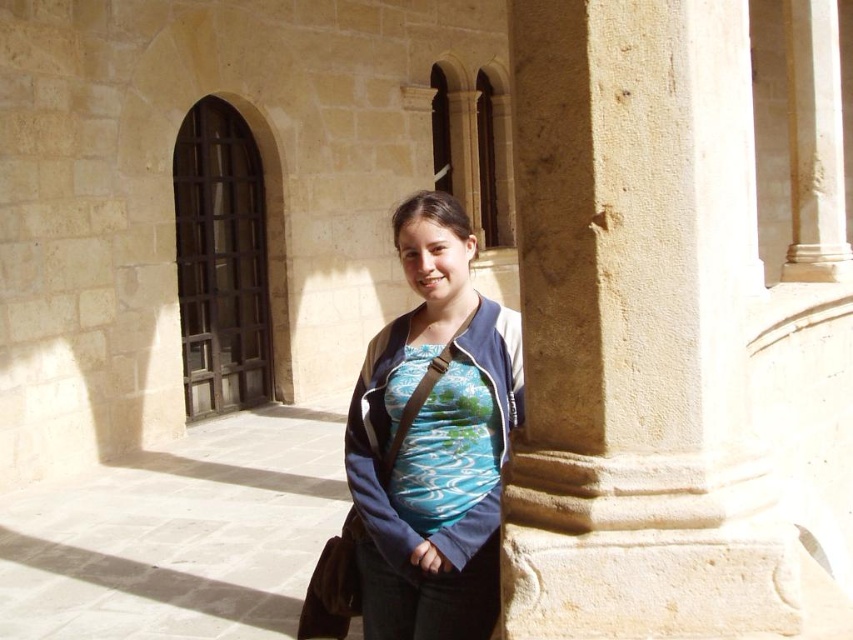
Is point (669, 51) positioned behind point (373, 442)?

No, (669, 51) is closer to viewer.

Does point (718, 452) lie in front of point (410, 202)?

Yes.

Does point (636, 269) come closer to viewer compared to point (416, 460)?

Yes, it is in front of point (416, 460).

Locate an element on the screen. This screenshot has width=853, height=640. beige stone pillar at center is located at coordinates (634, 336).

Looking at this image, between beige stone pillar at center and textured fabric shirt at center, which one has more height?

Standing taller between the two is beige stone pillar at center.

Between beige stone pillar at center and textured fabric shirt at center, which one has less height?

textured fabric shirt at center

Where is `beige stone pillar at center`? beige stone pillar at center is located at coordinates (634, 336).

Find the location of a particular element. This screenshot has height=640, width=853. beige stone pillar at center is located at coordinates (634, 336).

Does blue fabric shirt at center have a larger size compared to textured fabric shirt at center?

Indeed, blue fabric shirt at center has a larger size compared to textured fabric shirt at center.

Is blue fabric shirt at center behind textured fabric shirt at center?

No, blue fabric shirt at center is in front of textured fabric shirt at center.

Where is `blue fabric shirt at center`? blue fabric shirt at center is located at coordinates (434, 440).